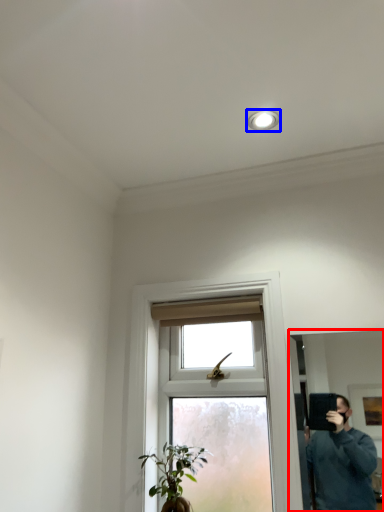
Question: Which object appears closest to the camera in this image, mirror (highlighted by a red box) or light fixture (highlighted by a blue box)?

Choices:
 (A) mirror
 (B) light fixture

Answer: (A)